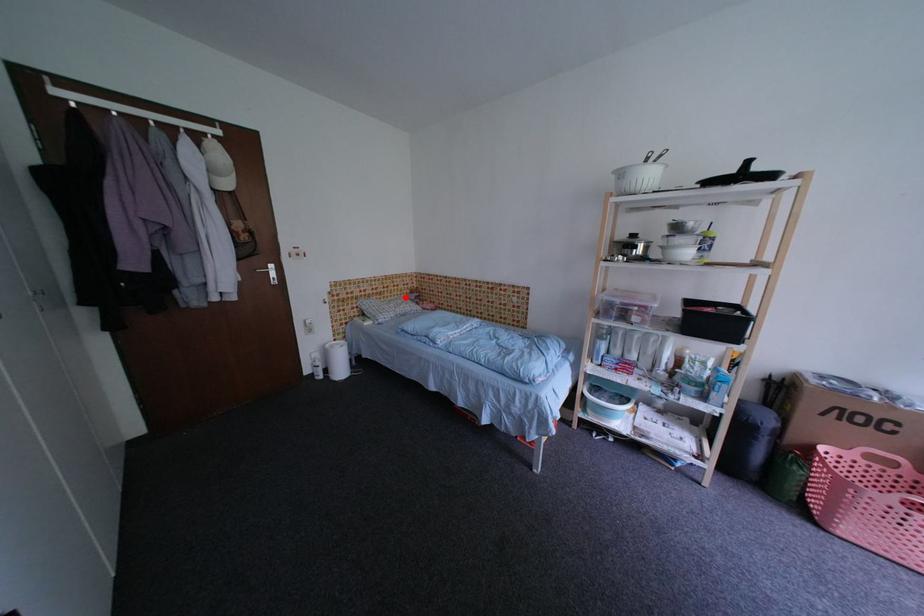
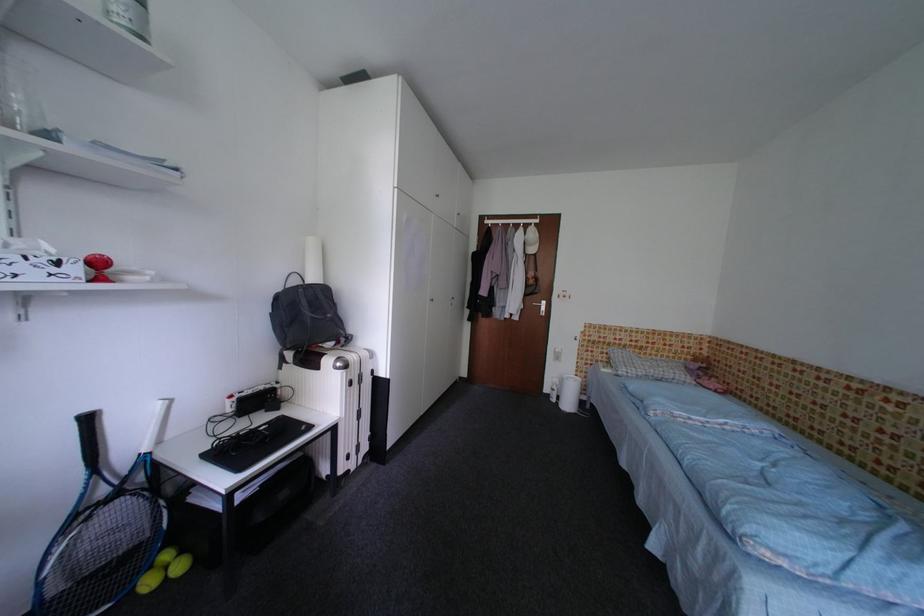
Where in the second image is the point corresponding to the highlighted location from the first image?

(675, 360)